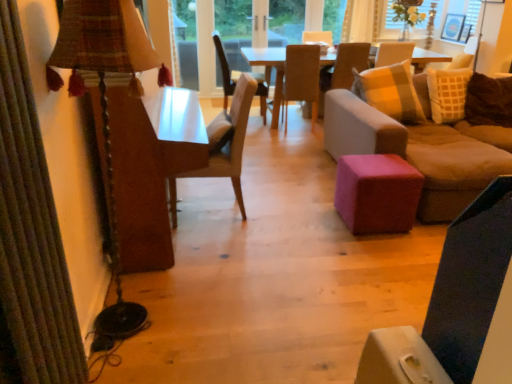
Question: From the image's perspective, is white sheer curtain at upper center under pink fabric ottoman at center?

Choices:
 (A) no
 (B) yes

Answer: (A)

Question: Does white sheer curtain at upper center appear on the right side of pink fabric ottoman at center?

Choices:
 (A) yes
 (B) no

Answer: (A)

Question: Is white sheer curtain at upper center facing away from pink fabric ottoman at center?

Choices:
 (A) yes
 (B) no

Answer: (B)

Question: Considering the relative sizes of white sheer curtain at upper center and pink fabric ottoman at center in the image provided, is white sheer curtain at upper center wider than pink fabric ottoman at center?

Choices:
 (A) yes
 (B) no

Answer: (B)

Question: Does white sheer curtain at upper center appear on the left side of pink fabric ottoman at center?

Choices:
 (A) no
 (B) yes

Answer: (A)

Question: Are white sheer curtain at upper center and pink fabric ottoman at center located far from each other?

Choices:
 (A) no
 (B) yes

Answer: (B)

Question: Is white fabric at upper right turned away from wooden chair at center, positioned as the third chair in right-to-left order?

Choices:
 (A) yes
 (B) no

Answer: (B)

Question: Can you confirm if white fabric at upper right is thinner than wooden chair at center, the first chair when ordered from back to front?

Choices:
 (A) no
 (B) yes

Answer: (B)

Question: Does white fabric at upper right lie behind wooden chair at center, positioned as the third chair in right-to-left order?

Choices:
 (A) no
 (B) yes

Answer: (B)

Question: Is white fabric at upper right to the right of wooden chair at center, positioned as the fourth chair in front-to-back order, from the viewer's perspective?

Choices:
 (A) no
 (B) yes

Answer: (B)

Question: Does white fabric at upper right have a smaller size compared to wooden chair at center, which is counted as the 2th chair, starting from the left?

Choices:
 (A) yes
 (B) no

Answer: (A)

Question: Is white fabric at upper right in contact with wooden chair at center, which is counted as the 2th chair, starting from the left?

Choices:
 (A) no
 (B) yes

Answer: (A)

Question: Can you confirm if light brown wooden chair at center, marked as the 2th chair in a back-to-front arrangement, is bigger than wooden chair at center, positioned as the fourth chair in front-to-back order?

Choices:
 (A) no
 (B) yes

Answer: (A)